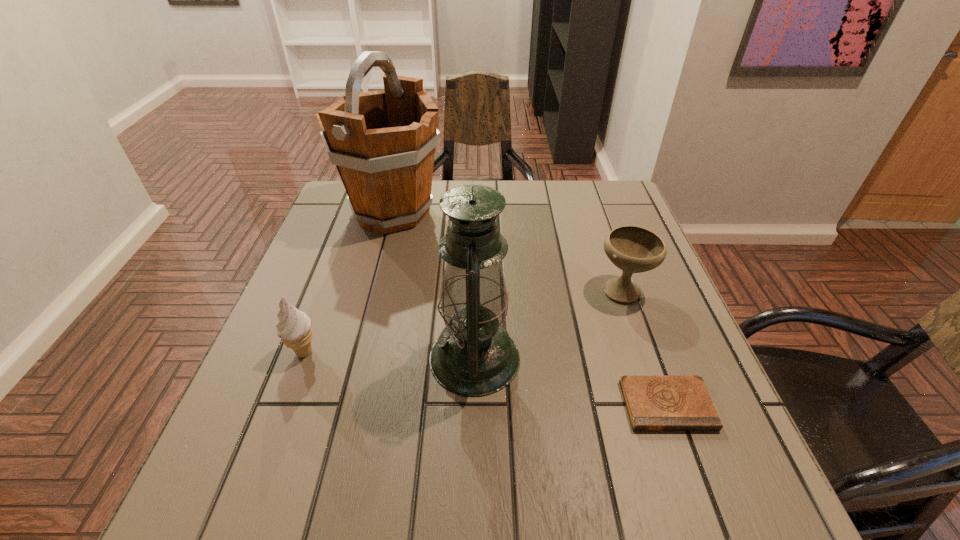
Locate an element on the screen. The height and width of the screenshot is (540, 960). free space at the far left corner is located at coordinates (340, 199).

Where is `vacant position at the near right corner of the desktop`? This screenshot has height=540, width=960. vacant position at the near right corner of the desktop is located at coordinates (684, 476).

Where is `free space between the oil lamp and the farthest object`? free space between the oil lamp and the farthest object is located at coordinates (433, 285).

Identify the location of vacant area between the chalice and the third object from left to right. The height and width of the screenshot is (540, 960). (549, 323).

The width and height of the screenshot is (960, 540). I want to click on blank region between the farthest object and the diary, so click(x=530, y=308).

Locate an element on the screen. The height and width of the screenshot is (540, 960). free spot between the farthest object and the icecream is located at coordinates (348, 282).

This screenshot has height=540, width=960. I want to click on empty space between the third object from left to right and the icecream, so click(390, 355).

I want to click on free space between the diary and the third object from right to left, so click(x=570, y=381).

Choose which object is the fourth nearest neighbor to the fourth nearest object. Please provide its 2D coordinates. Your answer should be formatted as a tuple, i.e. [(x, y)], where the tuple contains the x and y coordinates of a point satisfying the conditions above.

[(294, 327)]

Find the location of a particular element. This screenshot has height=540, width=960. object that is the fourth closest to the bucket is located at coordinates (654, 402).